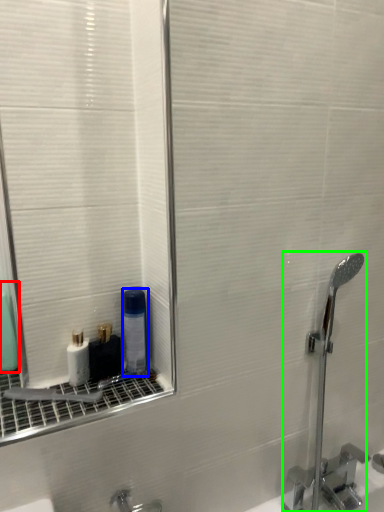
Question: Considering the real-world distances, which object is closest to mouthwash (highlighted by a red box)? mouthwash (highlighted by a blue box) or faucet (highlighted by a green box).

Choices:
 (A) mouthwash
 (B) faucet

Answer: (A)